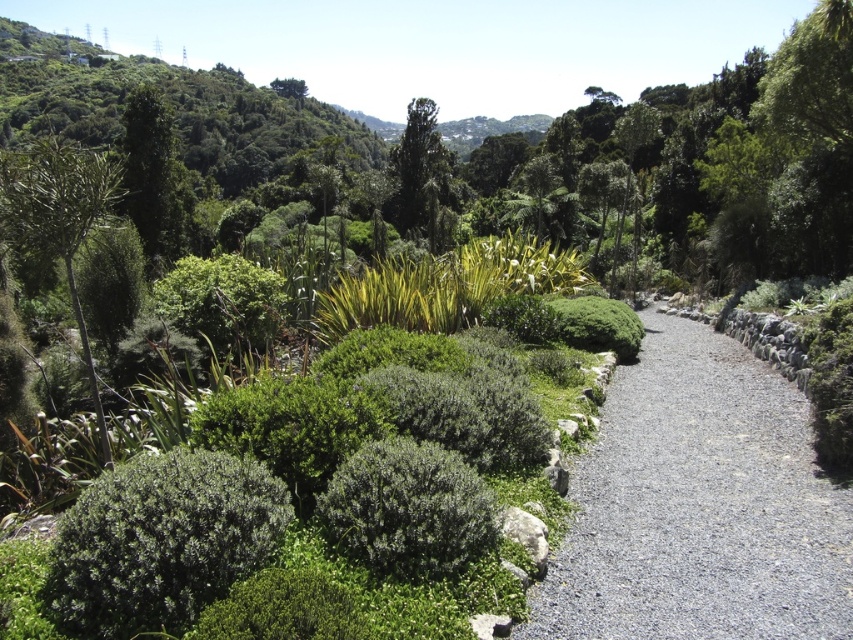
You are standing at the entrance of the garden and see two points marked in the scene. The first point is at coordinates point (706,506) and the second is at point (434,170). Which of these two points is closer to you?

Point (706,506) is closer to the viewer than point (434,170).

You are a gardener planning to plant flowers along the gray gravel path at center. Considering the green leafy tree at center, what should you consider about the sunlight availability for the flowers?

The gray gravel path at center is positioned under green leafy tree at center, which means the area receives less sunlight due to the tree canopy. Choose flowers that thrive in partial shade or full shade conditions.